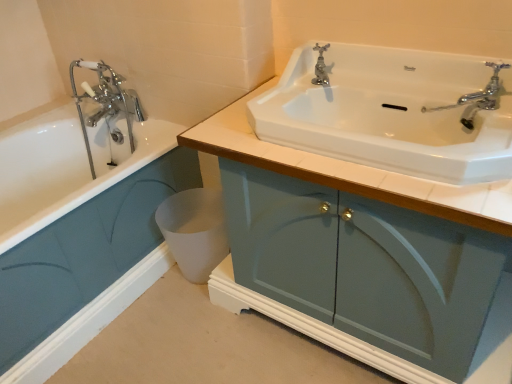
Question: Is white glossy sink at upper center wider than matte teal cabinet at lower left, the 2th bathroom cabinet positioned from the right?

Choices:
 (A) yes
 (B) no

Answer: (B)

Question: Is white glossy sink at upper center thinner than matte teal cabinet at lower left, the 1th bathroom cabinet positioned from the left?

Choices:
 (A) yes
 (B) no

Answer: (A)

Question: Does white glossy sink at upper center contain matte teal cabinet at lower left, the 2th bathroom cabinet positioned from the right?

Choices:
 (A) no
 (B) yes

Answer: (A)

Question: Is white glossy sink at upper center not near matte teal cabinet at lower left, the 1th bathroom cabinet positioned from the left?

Choices:
 (A) no
 (B) yes

Answer: (A)

Question: From a real-world perspective, is white glossy sink at upper center located higher than matte teal cabinet at lower left, the 2th bathroom cabinet positioned from the right?

Choices:
 (A) yes
 (B) no

Answer: (A)

Question: Does white glossy sink at upper center appear on the right side of matte teal cabinet at lower left, the 1th bathroom cabinet positioned from the left?

Choices:
 (A) no
 (B) yes

Answer: (B)

Question: Is white glossy sink at upper center behind matte blue cabinet at center, positioned as the 1th bathroom cabinet in right-to-left order?

Choices:
 (A) no
 (B) yes

Answer: (B)

Question: Would you say white glossy sink at upper center is a long distance from matte blue cabinet at center, positioned as the 1th bathroom cabinet in right-to-left order?

Choices:
 (A) no
 (B) yes

Answer: (A)

Question: Does white glossy sink at upper center have a greater height compared to matte blue cabinet at center, the 2th bathroom cabinet viewed from the left?

Choices:
 (A) yes
 (B) no

Answer: (B)

Question: Does white glossy sink at upper center have a lesser height compared to matte blue cabinet at center, the 2th bathroom cabinet viewed from the left?

Choices:
 (A) yes
 (B) no

Answer: (A)

Question: Is white glossy sink at upper center surrounding matte blue cabinet at center, positioned as the 1th bathroom cabinet in right-to-left order?

Choices:
 (A) yes
 (B) no

Answer: (B)

Question: Can you confirm if white glossy sink at upper center is positioned to the right of matte blue cabinet at center, the 2th bathroom cabinet viewed from the left?

Choices:
 (A) yes
 (B) no

Answer: (B)

Question: Does matte teal cabinet at lower left, the 1th bathroom cabinet positioned from the left, come behind white matte toilet bowl at lower center?

Choices:
 (A) no
 (B) yes

Answer: (A)